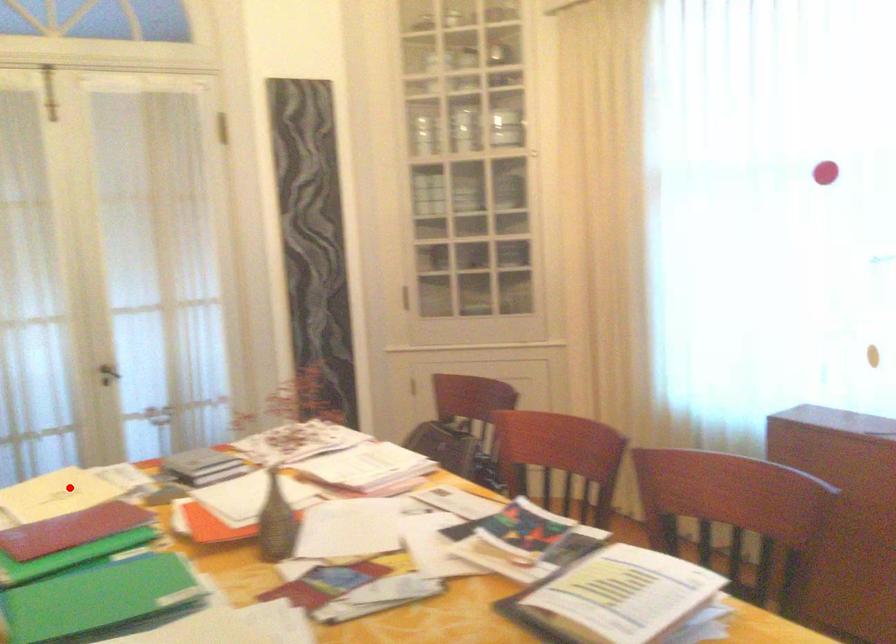
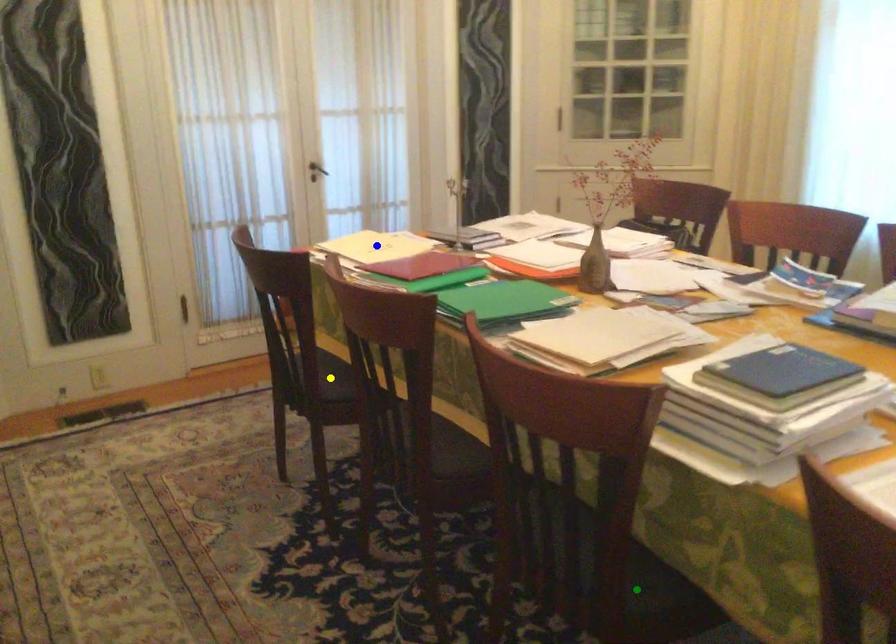
Question: I am providing you with two images of the same scene from different viewpoints. A red point is marked on the first image. You are given multiple points on the second image. Which mark in image 2 goes with the point in image 1?

Choices:
 (A) green point
 (B) blue point
 (C) yellow point

Answer: (B)